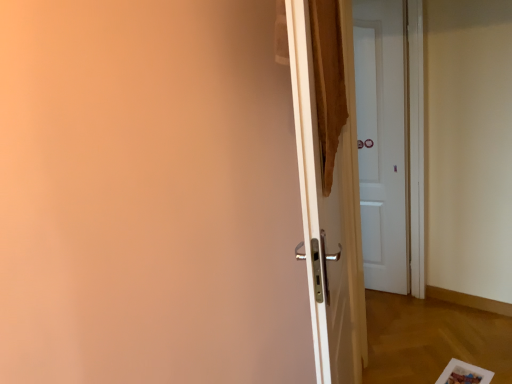
Question: Should I look upward or downward to see white glossy door at center, the second door from the back?

Choices:
 (A) down
 (B) up

Answer: (A)

Question: Does white matte door at center, which is counted as the 2th door, starting from the left, have a greater height compared to white glossy door at center, the second door from the back?

Choices:
 (A) yes
 (B) no

Answer: (A)

Question: Considering the relative sizes of white matte door at center, which is counted as the 2th door, starting from the left, and white glossy door at center, the first door when ordered from left to right, in the image provided, is white matte door at center, which is counted as the 2th door, starting from the left, smaller than white glossy door at center, the first door when ordered from left to right,?

Choices:
 (A) no
 (B) yes

Answer: (B)

Question: Is white matte door at center, which is counted as the 2th door, starting from the left, positioned with its back to white glossy door at center, the first door when ordered from left to right?

Choices:
 (A) yes
 (B) no

Answer: (B)

Question: Considering the relative sizes of white matte door at center, which is the 2th door from front to back, and white glossy door at center, positioned as the 1th door in front-to-back order, in the image provided, is white matte door at center, which is the 2th door from front to back, wider than white glossy door at center, positioned as the 1th door in front-to-back order,?

Choices:
 (A) yes
 (B) no

Answer: (A)

Question: Is white matte door at center, which is counted as the 2th door, starting from the left, facing towards white glossy door at center, which is the 2th door from right to left?

Choices:
 (A) no
 (B) yes

Answer: (B)

Question: Is white matte door at center, which is the 2th door from front to back, outside white glossy door at center, the first door when ordered from left to right?

Choices:
 (A) no
 (B) yes

Answer: (B)

Question: From a real-world perspective, is white glossy door at center, which is the 2th door from right to left, on top of white matte door at center, which is the first door in back-to-front order?

Choices:
 (A) yes
 (B) no

Answer: (B)

Question: Considering the relative sizes of white glossy door at center, positioned as the 1th door in front-to-back order, and white matte door at center, which is the first door in back-to-front order, in the image provided, is white glossy door at center, positioned as the 1th door in front-to-back order, thinner than white matte door at center, which is the first door in back-to-front order,?

Choices:
 (A) yes
 (B) no

Answer: (A)

Question: Does white glossy door at center, positioned as the 1th door in front-to-back order, appear on the right side of white matte door at center, which is counted as the 2th door, starting from the left?

Choices:
 (A) yes
 (B) no

Answer: (B)

Question: Is white matte door at center, which is counted as the 2th door, starting from the left, at the back of white glossy door at center, the first door when ordered from left to right?

Choices:
 (A) yes
 (B) no

Answer: (B)

Question: Considering the relative sizes of white glossy door at center, the second door from the back, and white matte door at center, which ranks as the first door in right-to-left order, in the image provided, is white glossy door at center, the second door from the back, shorter than white matte door at center, which ranks as the first door in right-to-left order,?

Choices:
 (A) yes
 (B) no

Answer: (A)

Question: Is white glossy door at center, the first door when ordered from left to right, not within white matte door at center, which ranks as the first door in right-to-left order?

Choices:
 (A) yes
 (B) no

Answer: (A)

Question: Relative to white matte door at center, which is the first door in back-to-front order, is white glossy door at center, positioned as the 1th door in front-to-back order, in front or behind?

Choices:
 (A) front
 (B) behind

Answer: (A)